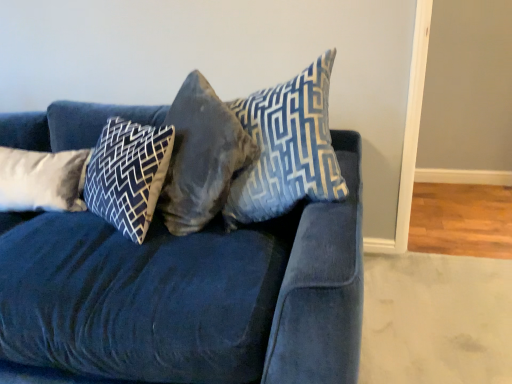
Question: Considering the relative sizes of velvet blue couch at center and dark blue velvet pillow at center, which ranks as the 3th pillow in right-to-left order, in the image provided, is velvet blue couch at center thinner than dark blue velvet pillow at center, which ranks as the 3th pillow in right-to-left order,?

Choices:
 (A) yes
 (B) no

Answer: (B)

Question: Is velvet blue couch at center outside of dark blue velvet pillow at center, which ranks as the 3th pillow in right-to-left order?

Choices:
 (A) no
 (B) yes

Answer: (B)

Question: Is velvet blue couch at center in front of dark blue velvet pillow at center, the 2th pillow when ordered from left to right?

Choices:
 (A) yes
 (B) no

Answer: (A)

Question: Is the surface of velvet blue couch at center in direct contact with dark blue velvet pillow at center, the 2th pillow when ordered from left to right?

Choices:
 (A) no
 (B) yes

Answer: (A)

Question: From the image's perspective, is velvet blue couch at center above dark blue velvet pillow at center, which ranks as the 3th pillow in right-to-left order?

Choices:
 (A) yes
 (B) no

Answer: (B)

Question: Are velvet blue couch at center and dark blue velvet pillow at center, the 2th pillow when ordered from left to right, far apart?

Choices:
 (A) yes
 (B) no

Answer: (B)

Question: From a real-world perspective, does velvet blue couch at center sit lower than velvet gray pillow at center, positioned as the 3th pillow in left-to-right order?

Choices:
 (A) no
 (B) yes

Answer: (B)

Question: Can you confirm if velvet blue couch at center is positioned to the right of velvet gray pillow at center, positioned as the second pillow in right-to-left order?

Choices:
 (A) no
 (B) yes

Answer: (A)

Question: Are velvet blue couch at center and velvet gray pillow at center, positioned as the 3th pillow in left-to-right order, far apart?

Choices:
 (A) no
 (B) yes

Answer: (A)

Question: Does velvet blue couch at center turn towards velvet gray pillow at center, positioned as the 3th pillow in left-to-right order?

Choices:
 (A) no
 (B) yes

Answer: (B)

Question: Considering the relative sizes of velvet blue couch at center and velvet gray pillow at center, positioned as the second pillow in right-to-left order, in the image provided, is velvet blue couch at center thinner than velvet gray pillow at center, positioned as the second pillow in right-to-left order,?

Choices:
 (A) yes
 (B) no

Answer: (B)

Question: Does velvet blue couch at center have a smaller size compared to velvet gray pillow at center, positioned as the 3th pillow in left-to-right order?

Choices:
 (A) yes
 (B) no

Answer: (B)

Question: From the image's perspective, is velvet gray pillow at center, positioned as the 3th pillow in left-to-right order, above velvet blue couch at center?

Choices:
 (A) no
 (B) yes

Answer: (B)